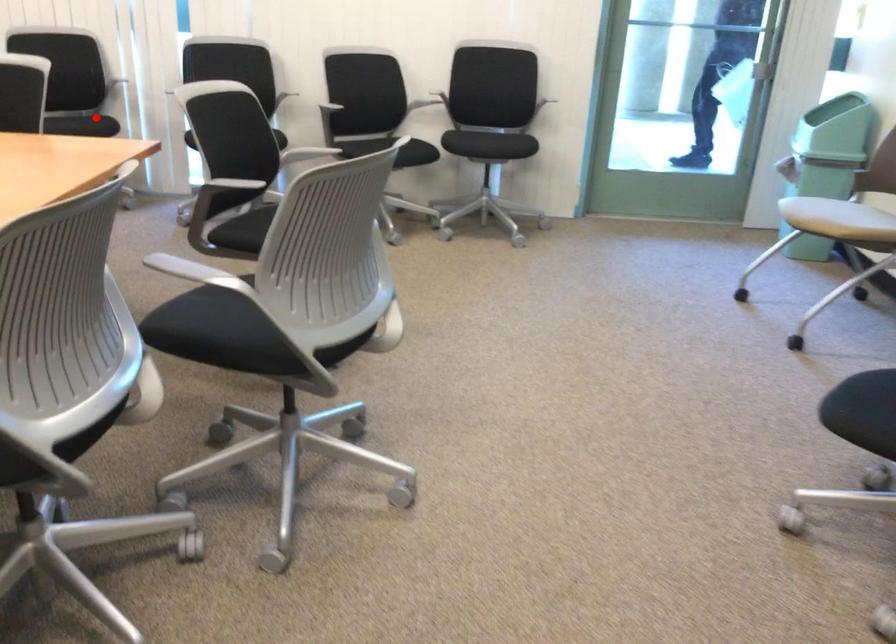
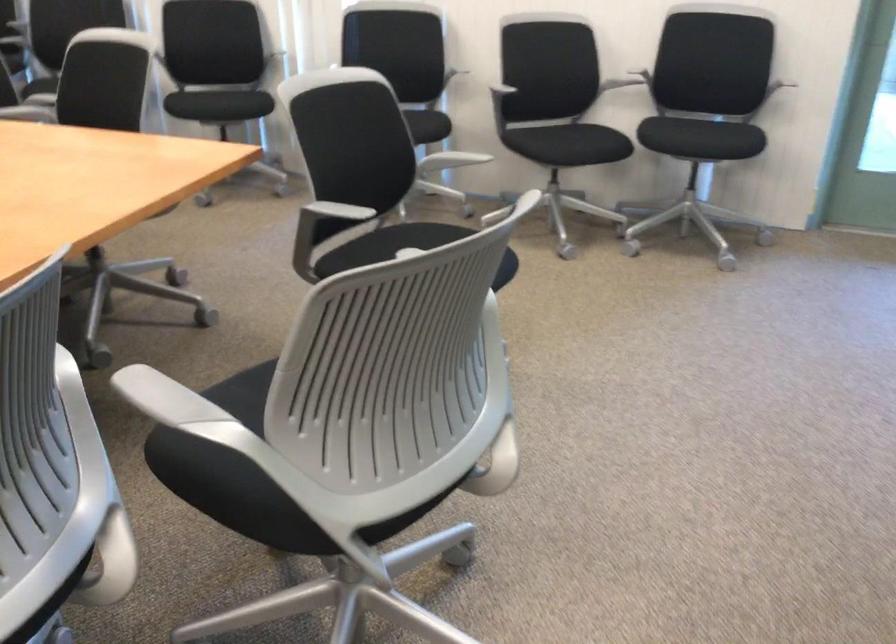
Locate, in the second image, the point that corresponds to the highlighted location in the first image.

(238, 102)